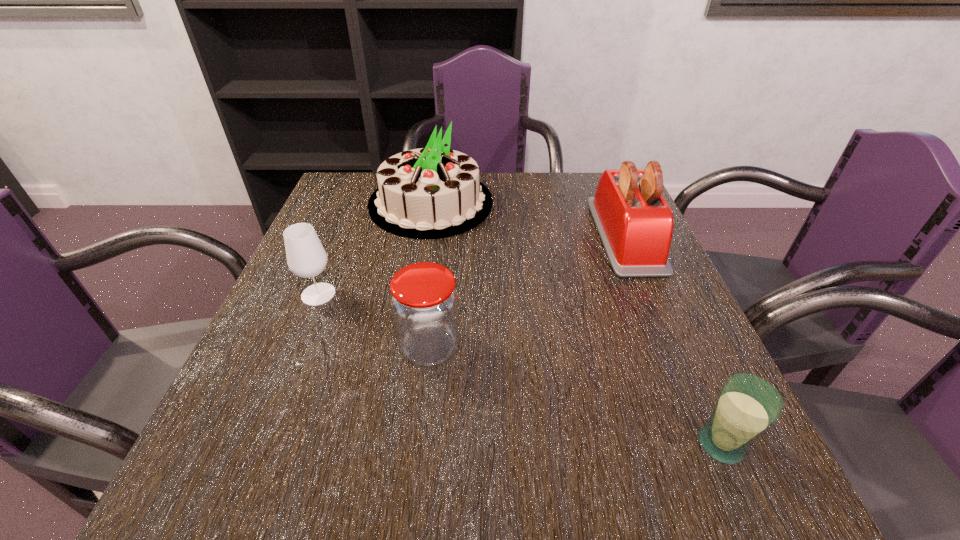
Locate an element on the screen. The height and width of the screenshot is (540, 960). free point between the toaster and the birthday cake is located at coordinates (528, 219).

Find the location of `vacant space that's between the toaster and the birthday cake`. vacant space that's between the toaster and the birthday cake is located at coordinates (528, 219).

Identify the location of free space between the birthday cake and the right glass. (576, 323).

This screenshot has height=540, width=960. I want to click on free space between the toaster and the second nearest object, so click(x=527, y=291).

The height and width of the screenshot is (540, 960). I want to click on empty space that is in between the left glass and the toaster, so click(471, 265).

Find the location of a particular element. This screenshot has width=960, height=540. free space between the left glass and the nearer glass is located at coordinates (519, 369).

This screenshot has height=540, width=960. In order to click on vacant area that lies between the nearest object and the toaster in this screenshot , I will do `click(673, 340)`.

The height and width of the screenshot is (540, 960). I want to click on unoccupied area between the farther glass and the shorter glass, so click(x=519, y=369).

Where is `object that is the closest one to the jar`? The width and height of the screenshot is (960, 540). object that is the closest one to the jar is located at coordinates (306, 257).

The width and height of the screenshot is (960, 540). I want to click on object that is the second closest one to the right glass, so click(x=424, y=302).